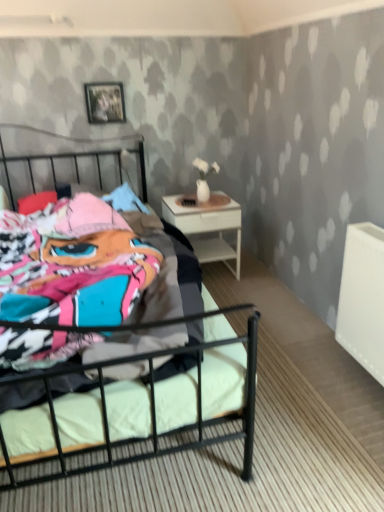
Where is `free spot to the right of white glossy nightstand at right`? This screenshot has width=384, height=512. free spot to the right of white glossy nightstand at right is located at coordinates (260, 277).